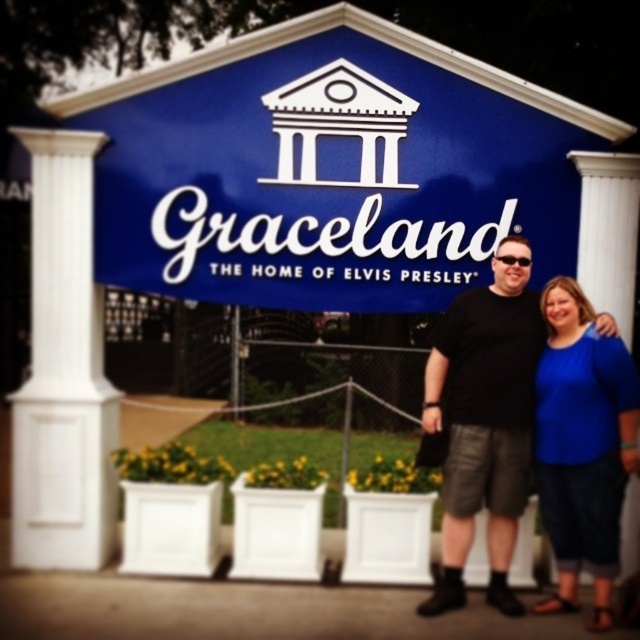
Can you confirm if white smooth column at left is bigger than blue painted sign at center?

No.

Does point (92, 173) come in front of point (499, 102)?

Yes, point (92, 173) is closer to viewer.

Is point (76, 218) farther from viewer compared to point (163, 81)?

That is False.

Locate an element on the screen. The width and height of the screenshot is (640, 640). white smooth column at left is located at coordinates (64, 371).

Does white smooth column at left have a smaller size compared to black matte shirt at center?

Actually, white smooth column at left might be larger than black matte shirt at center.

Does white smooth column at left have a greater width compared to black matte shirt at center?

In fact, white smooth column at left might be narrower than black matte shirt at center.

Which is in front, point (33, 536) or point (451, 518)?

Positioned in front is point (451, 518).

Find the location of a particular element. white smooth column at left is located at coordinates (64, 371).

Locate an element on the screen. This screenshot has width=640, height=640. white smooth column at left is located at coordinates (64, 371).

This screenshot has height=640, width=640. What are the coordinates of `white smooth column at left` in the screenshot? It's located at [64, 371].